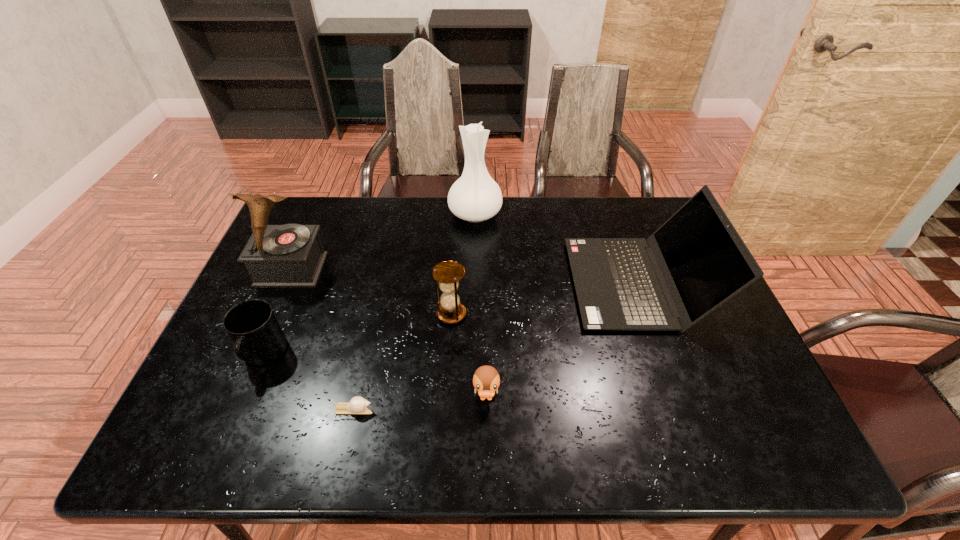
Where is `vacant position in the image that satisfies the following two spatial constraints: 1. on the front side of the vase; 2. on the shell of the shortest object`? The height and width of the screenshot is (540, 960). vacant position in the image that satisfies the following two spatial constraints: 1. on the front side of the vase; 2. on the shell of the shortest object is located at coordinates tap(472, 409).

The image size is (960, 540). Find the location of `blank space that satisfies the following two spatial constraints: 1. on the screen of the rightmost object; 2. on the side of the third shortest object with the handle`. blank space that satisfies the following two spatial constraints: 1. on the screen of the rightmost object; 2. on the side of the third shortest object with the handle is located at coordinates (663, 354).